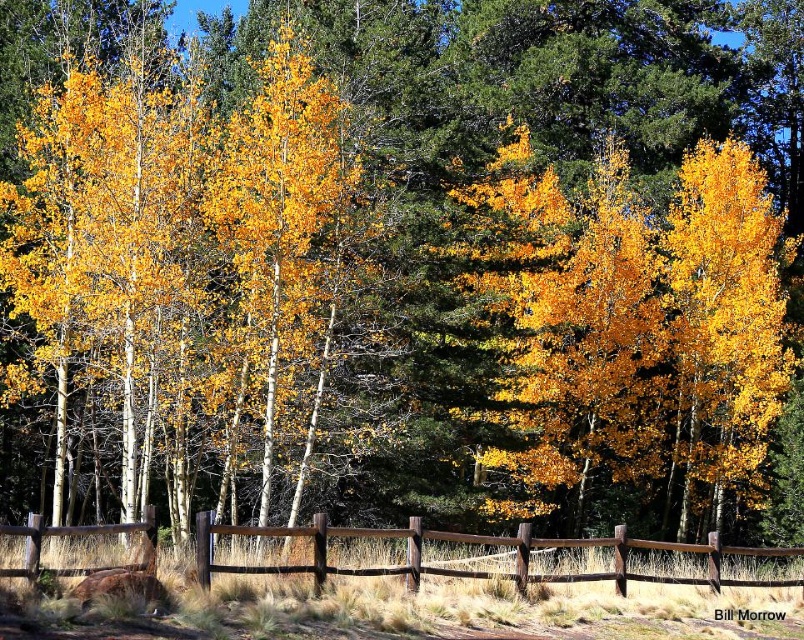
Is golden yellow bark birch at center to the left of brown wooden fence at center from the viewer's perspective?

Correct, you'll find golden yellow bark birch at center to the left of brown wooden fence at center.

Who is positioned more to the left, golden yellow bark birch at center or brown wooden fence at center?

Positioned to the left is golden yellow bark birch at center.

Is point (222, 220) less distant than point (521, 592)?

No, (222, 220) is behind (521, 592).

Locate an element on the screen. golden yellow bark birch at center is located at coordinates 282,237.

Is golden yellow bark birch at center bigger than matte yellow birch at right?

Yes.

You are a GUI agent. You are given a task and a screenshot of the screen. Output one action in this format:
    pyautogui.click(x=<x>, y=<y>)
    Task: Click on the golden yellow bark birch at center
    The height and width of the screenshot is (640, 804).
    Given the screenshot: What is the action you would take?
    pyautogui.click(x=282, y=237)

Between point (293, 186) and point (753, 340), which one is positioned in front?

Point (293, 186) is more forward.

You are a GUI agent. You are given a task and a screenshot of the screen. Output one action in this format:
    pyautogui.click(x=<x>, y=<y>)
    Task: Click on the golden yellow bark birch at center
    
    Given the screenshot: What is the action you would take?
    pyautogui.click(x=282, y=237)

Between matte yellow birch at right and brown wooden fence at center, which one has more height?

matte yellow birch at right

Which is in front, point (770, 392) or point (39, 536)?

Point (39, 536) is in front.

I want to click on matte yellow birch at right, so click(725, 320).